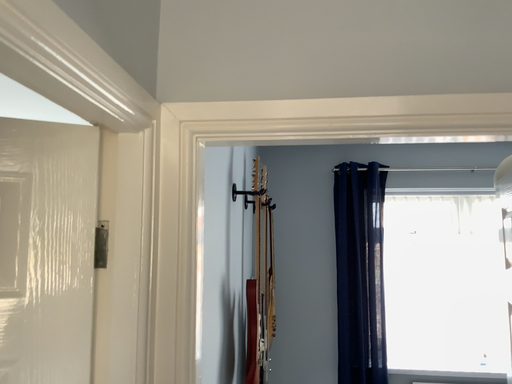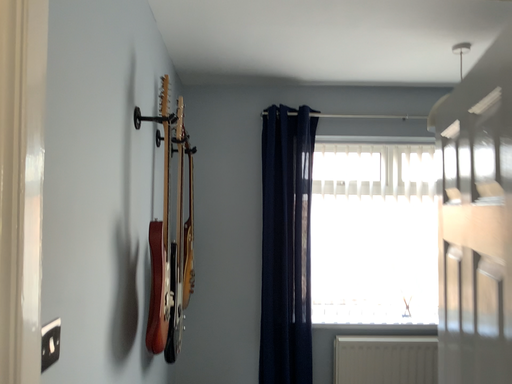
Question: Which way did the camera rotate in the video?

Choices:
 (A) rotated left
 (B) rotated right

Answer: (B)